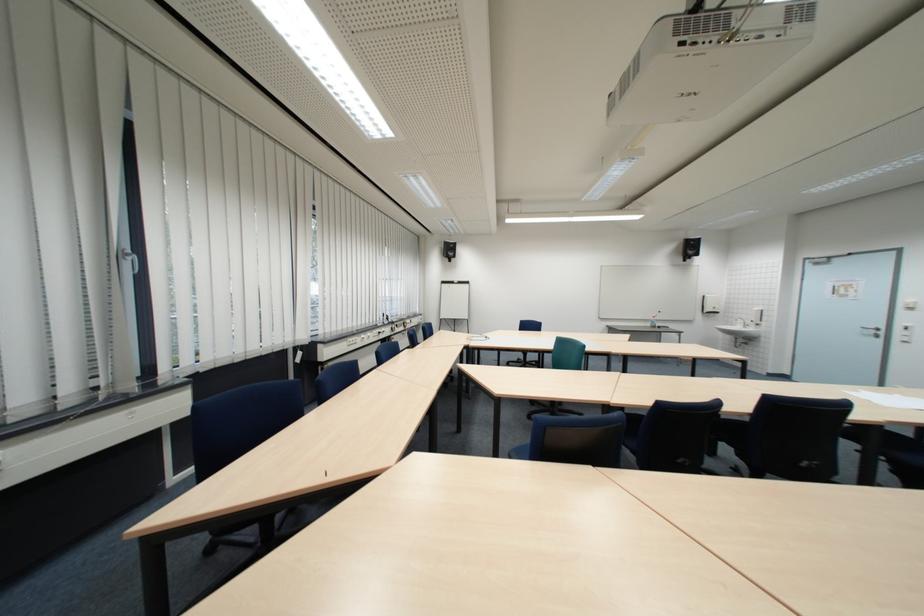
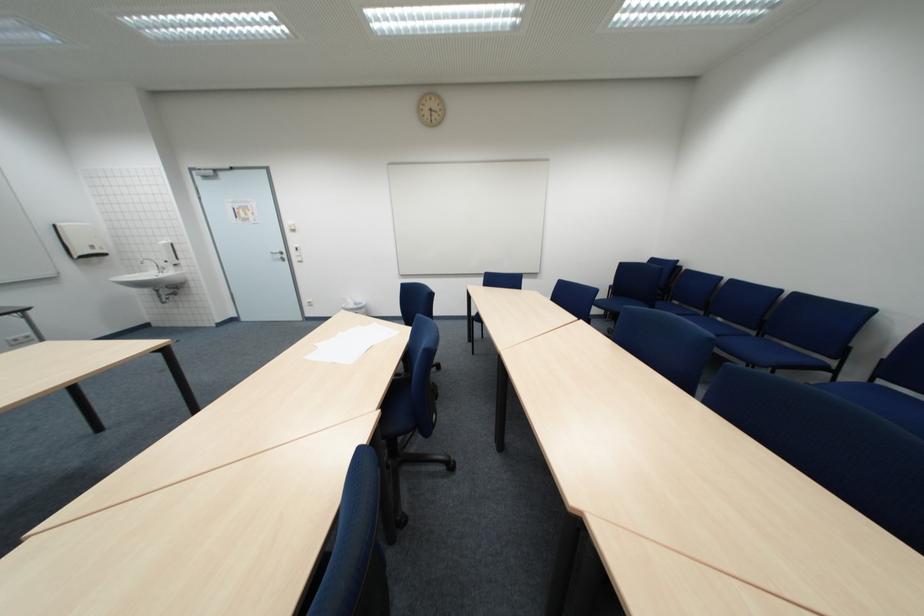
Find the pixel in the second image that matches pixel 761 323 in the first image.

(176, 265)